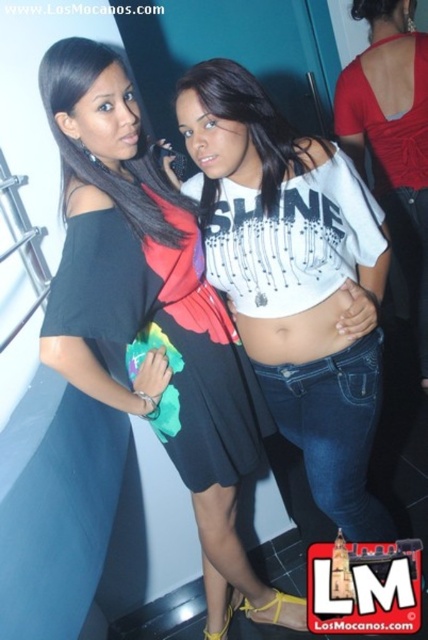
You are a photographer adjusting lighting for a portrait. You need to ensure that the matte black dress at center and the white matte skin at center are both well lit. Considering their sizes, which object requires a wider light spread to cover its area?

The white matte skin at center requires a wider light spread because it has a greater width than the matte black dress at center.

You are a photographer trying to focus on the black matte dress at center and the white matte skin at center in the image. Which object should you adjust your camera focus on first to ensure it appears sharp in the final photo?

The black matte dress at center is closer to the viewer than the white matte skin at center, so you should focus on the black matte dress at center first to ensure proper depth of field.

You are a photographer at the event and want to ensure both the matte black dress at center and the white matte skin at center are clearly visible in your photo. Given that the dress is larger, how should you adjust your camera focus to capture both effectively?

Since the matte black dress at center is larger in size than the white matte skin at center, you should focus on the matte black dress at center to ensure its details are sharp while keeping the white matte skin at center within the depth of field.